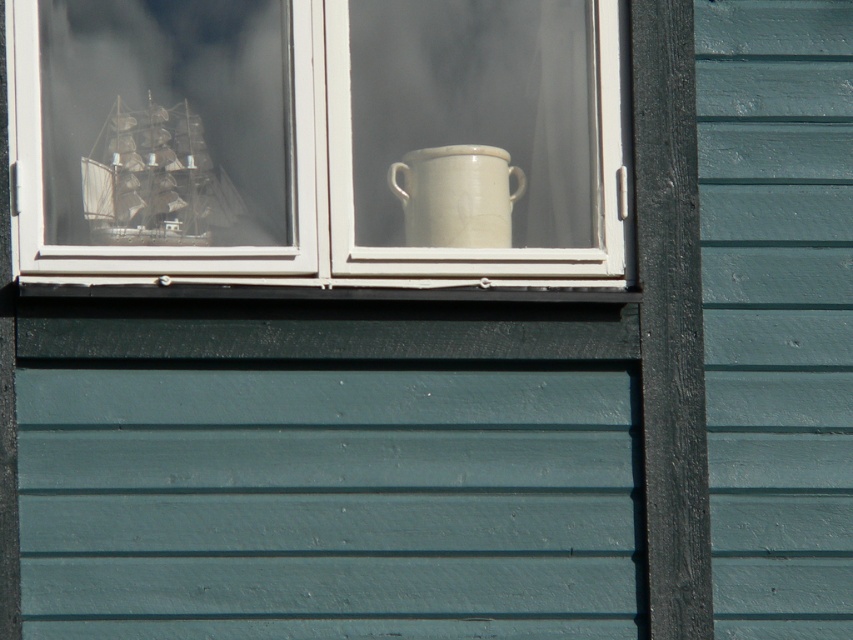
Question: Which is nearer to the wooden ship at left?

Choices:
 (A) teal painted wood siding at right
 (B) white ceramic mug at upper center

Answer: (B)

Question: Is white glossy pot at center further to camera compared to teal painted wood siding at right?

Choices:
 (A) yes
 (B) no

Answer: (B)

Question: Estimate the real-world distances between objects in this image. Which object is farther from the white ceramic mug at upper center?

Choices:
 (A) teal painted wood siding at right
 (B) white glossy pot at center
 (C) wooden ship at left

Answer: (A)

Question: Where is white glossy pot at center located in relation to white ceramic mug at upper center in the image?

Choices:
 (A) left
 (B) right

Answer: (A)

Question: Which is nearer to the white ceramic mug at upper center?

Choices:
 (A) white glossy pot at center
 (B) teal painted wood siding at right

Answer: (A)

Question: Is teal painted wood siding at right further to the viewer compared to wooden ship at left?

Choices:
 (A) yes
 (B) no

Answer: (B)